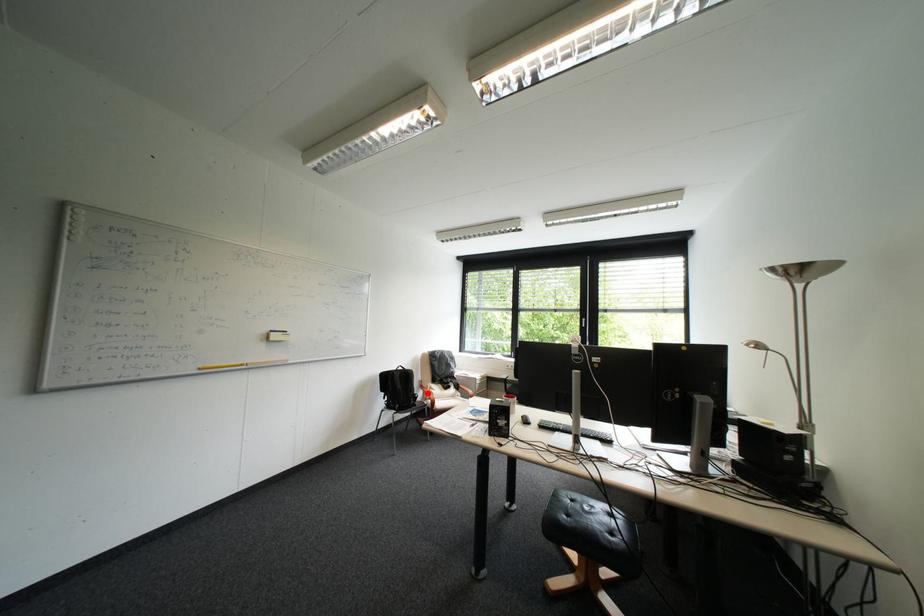
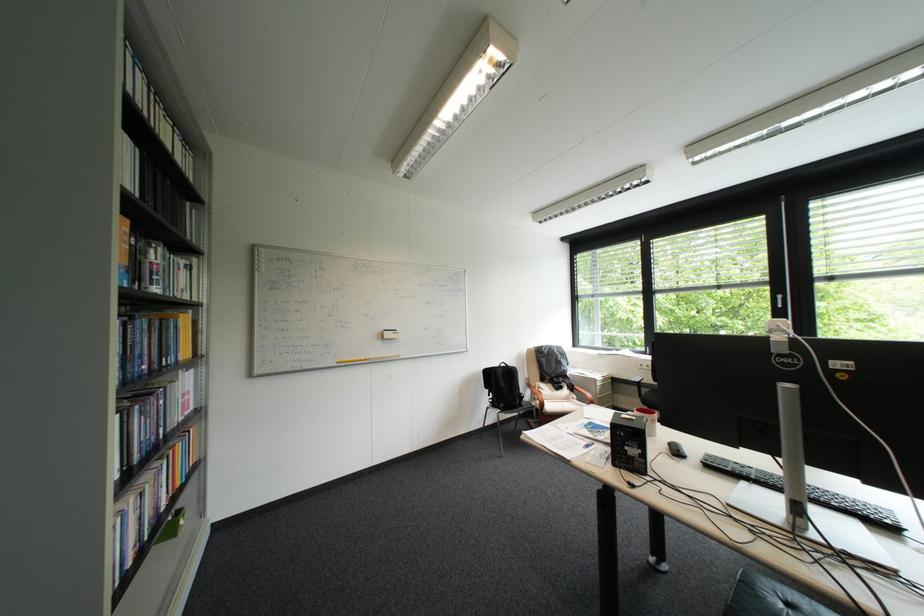
Question: I am providing you with two images of the same scene from different viewpoints. In image1, a red point is highlighted. Considering the same 3D point in image2, which of the following is correct?

Choices:
 (A) It is closer
 (B) It is farther

Answer: (B)